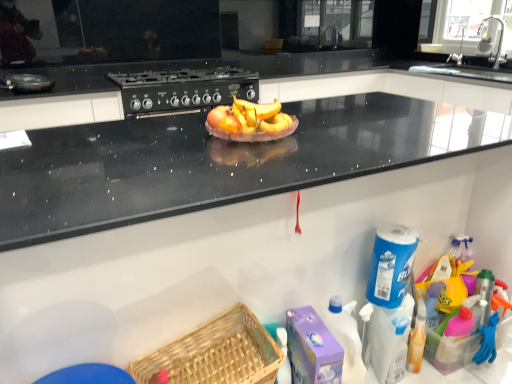
Question: From the image's perspective, would you say black matte gas stove at upper center is positioned over yellow matte bananas at center?

Choices:
 (A) no
 (B) yes

Answer: (B)

Question: Can you confirm if black matte gas stove at upper center is smaller than yellow matte bananas at center?

Choices:
 (A) no
 (B) yes

Answer: (A)

Question: From a real-world perspective, is black matte gas stove at upper center on yellow matte bananas at center?

Choices:
 (A) no
 (B) yes

Answer: (A)

Question: Is black matte gas stove at upper center at the left side of yellow matte bananas at center?

Choices:
 (A) yes
 (B) no

Answer: (A)

Question: Is black matte gas stove at upper center in contact with yellow matte bananas at center?

Choices:
 (A) yes
 (B) no

Answer: (B)

Question: Is black matte gas stove at upper center positioned with its back to yellow matte bananas at center?

Choices:
 (A) no
 (B) yes

Answer: (A)

Question: Can you confirm if metallic faucet at upper right, arranged as the first faucet when viewed from the front, is wider than woven wood basket at lower center?

Choices:
 (A) no
 (B) yes

Answer: (A)

Question: Does metallic faucet at upper right, placed as the 2th faucet when sorted from back to front, appear on the right side of woven wood basket at lower center?

Choices:
 (A) no
 (B) yes

Answer: (B)

Question: Can you confirm if metallic faucet at upper right, arranged as the first faucet when viewed from the front, is shorter than woven wood basket at lower center?

Choices:
 (A) no
 (B) yes

Answer: (A)

Question: From a real-world perspective, does metallic faucet at upper right, arranged as the first faucet when viewed from the front, stand above woven wood basket at lower center?

Choices:
 (A) no
 (B) yes

Answer: (B)

Question: Does metallic faucet at upper right, arranged as the first faucet when viewed from the front, appear on the left side of woven wood basket at lower center?

Choices:
 (A) yes
 (B) no

Answer: (B)

Question: From the image's perspective, would you say metallic faucet at upper right, placed as the 2th faucet when sorted from back to front, is positioned over woven wood basket at lower center?

Choices:
 (A) yes
 (B) no

Answer: (A)

Question: Is yellow matte bananas at center positioned with its back to black matte gas stove at upper center?

Choices:
 (A) yes
 (B) no

Answer: (A)